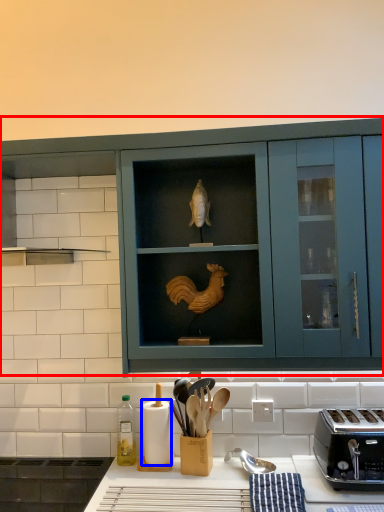
Question: Which point is closer to the camera, cabinetry (highlighted by a red box) or paper towel (highlighted by a blue box)?

Choices:
 (A) cabinetry
 (B) paper towel

Answer: (A)